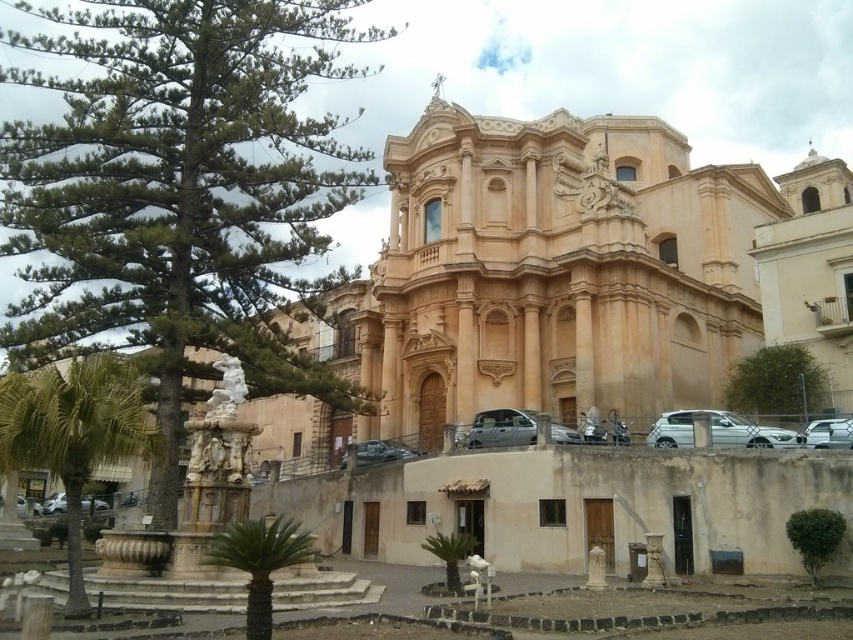
In the scene shown: Does green textured pine tree at left have a lesser width compared to green leafy pine at center?

No, green textured pine tree at left is not thinner than green leafy pine at center.

Does green textured pine tree at left have a smaller size compared to green leafy pine at center?

No, green textured pine tree at left is not smaller than green leafy pine at center.

Is point (170, 330) in front of point (451, 564)?

No, it is not.

You are a GUI agent. You are given a task and a screenshot of the screen. Output one action in this format:
    pyautogui.click(x=<x>, y=<y>)
    Task: Click on the green textured pine tree at left
    
    Given the screenshot: What is the action you would take?
    pyautogui.click(x=178, y=195)

Is green textured pine tree at left thinner than metallic silver car at center?

In fact, green textured pine tree at left might be wider than metallic silver car at center.

Is the position of green textured pine tree at left less distant than that of metallic silver car at center?

Yes, it is.

Which is behind, point (177, 388) or point (490, 426)?

The point (490, 426) is behind.

The width and height of the screenshot is (853, 640). In order to click on green textured pine tree at left in this screenshot , I will do [178, 195].

Which is more to the left, metallic silver car at center or green leafy pine at center?

green leafy pine at center is more to the left.

Can you confirm if metallic silver car at center is positioned above green leafy pine at center?

Indeed, metallic silver car at center is positioned over green leafy pine at center.

Where is `metallic silver car at center`? This screenshot has height=640, width=853. metallic silver car at center is located at coordinates (500, 428).

Find the location of `metallic silver car at center`. metallic silver car at center is located at coordinates (500, 428).